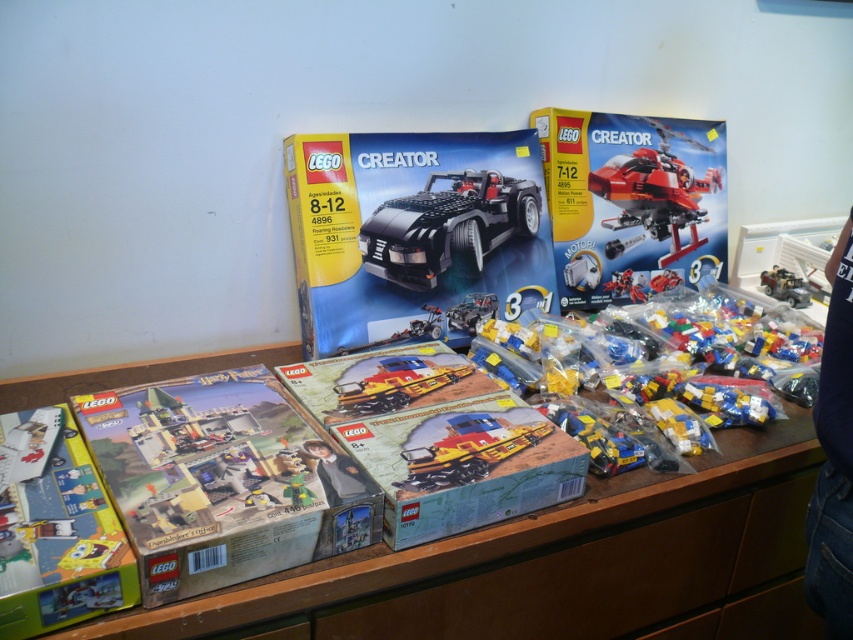
Question: Can you confirm if matte brown train at center is wider than metallic blue train at center?

Choices:
 (A) yes
 (B) no

Answer: (A)

Question: Is blue denim jeans at lower right wider than metallic silver car at center-right?

Choices:
 (A) no
 (B) yes

Answer: (B)

Question: Which point is closer to the camera?

Choices:
 (A) wooden drawer at lower center
 (B) metallic yellow train at center
 (C) matte red helicopter at center
 (D) black matte car at center

Answer: (A)

Question: Which point is farther from the camera taking this photo?

Choices:
 (A) (45, 496)
 (B) (338, 384)
 (C) (662, 262)
 (D) (605, 486)

Answer: (C)

Question: Which point appears farthest from the camera in this image?

Choices:
 (A) (354, 400)
 (B) (668, 177)

Answer: (B)

Question: Does black matte car at center have a lesser width compared to metallic yellow train at center?

Choices:
 (A) yes
 (B) no

Answer: (B)